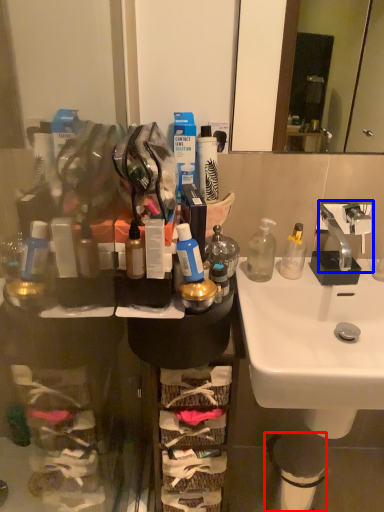
Question: Which object is further to the camera taking this photo, trash bin/can (highlighted by a red box) or tap (highlighted by a blue box)?

Choices:
 (A) trash bin/can
 (B) tap

Answer: (A)